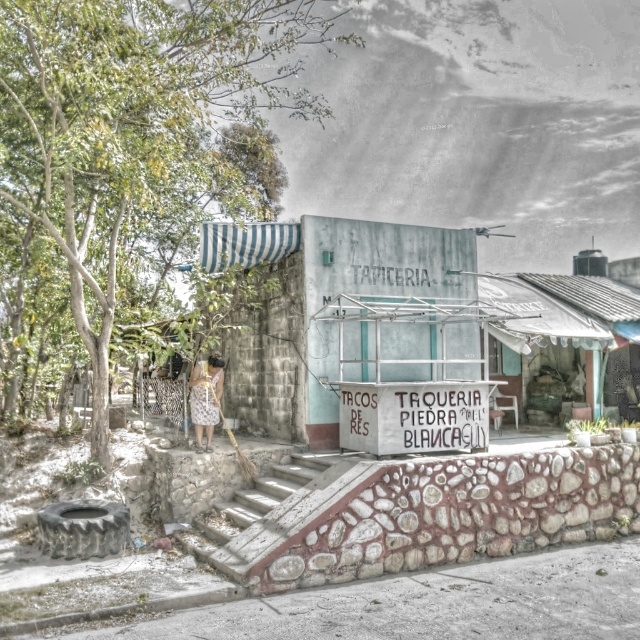
Does concrete stairs at center have a lesser width compared to patterned fabric dress at center?

No, concrete stairs at center is not thinner than patterned fabric dress at center.

Measure the distance between point (252, 506) and camera.

Point (252, 506) and camera are 34.99 feet apart from each other.

Where is `concrete stairs at center`? The width and height of the screenshot is (640, 640). concrete stairs at center is located at coordinates (x=256, y=502).